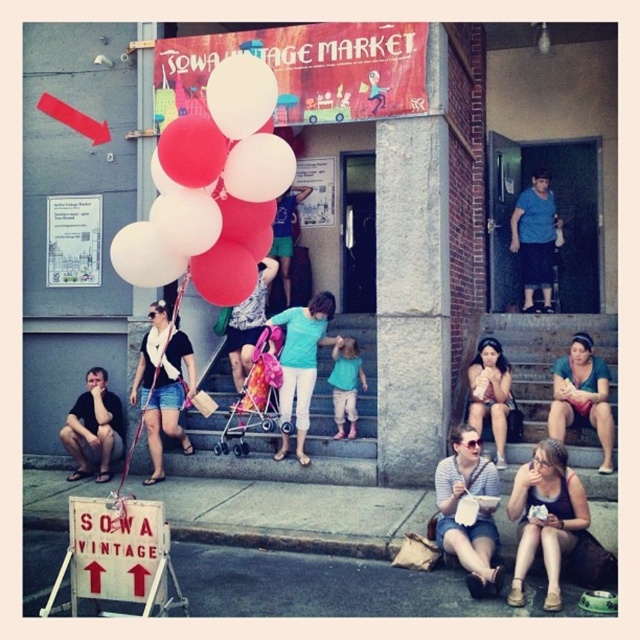
You are standing at the entrance of the SOWA VINTAGE MARKET and notice two people wearing shirts. One is wearing a teal fabric shirt at lower right and the other a blue cotton shirt at upper center. From your vantage point, which shirt appears closer to you?

The teal fabric shirt at lower right is located below the blue cotton shirt at upper center, so it appears closer to you since it is positioned lower in the image.

You are standing at the entrance of the SOWA VINTAGE MARKET and want to take a photo of both the point at coordinates point (586, 355) and point (552, 244). Which point should you focus on first to ensure both are in the frame?

You should focus on point (586, 355) first because it is closer to the viewer than point (552, 244), ensuring both points are within the camera frame.

You are a parent holding a baby and want to push the matte pink stroller at center up the steps where the matte teal shirt at center is standing. Can the stroller fit between the people on the steps?

The matte pink stroller at center is shorter than the matte teal shirt at center, so it may fit between them if there is enough space. However, the exact height clearance isn